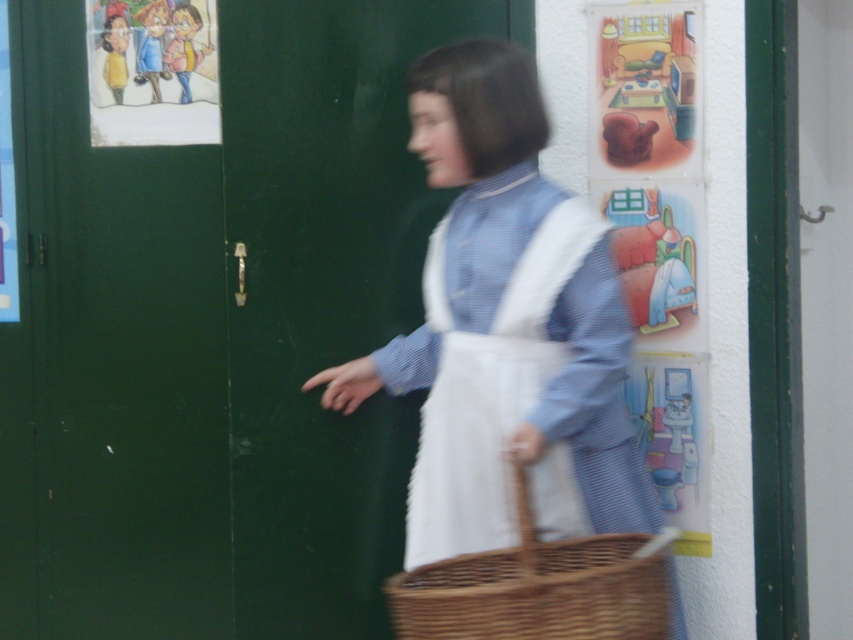
Question: Estimate the real-world distances between objects in this image. Which object is closer to the cartoon paper at upper left?

Choices:
 (A) green matte door at left
 (B) white cotton apron at center
 (C) matte plastic poster at upper left
 (D) woven brown basket at center

Answer: (A)

Question: Is green matte door at center below matte plastic poster at upper left?

Choices:
 (A) yes
 (B) no

Answer: (A)

Question: Can you confirm if green matte door at left is positioned below cartoon paper at upper left?

Choices:
 (A) yes
 (B) no

Answer: (A)

Question: Which point is farther to the camera?

Choices:
 (A) 15,509
 (B) 13,227
 (C) 473,531
 (D) 416,404

Answer: (A)

Question: Which of the following is the farthest from the observer?

Choices:
 (A) matte plastic poster at upper left
 (B) green matte door at center
 (C) green matte door at left

Answer: (A)

Question: Is green matte door at center in front of matte plastic poster at upper left?

Choices:
 (A) yes
 (B) no

Answer: (A)